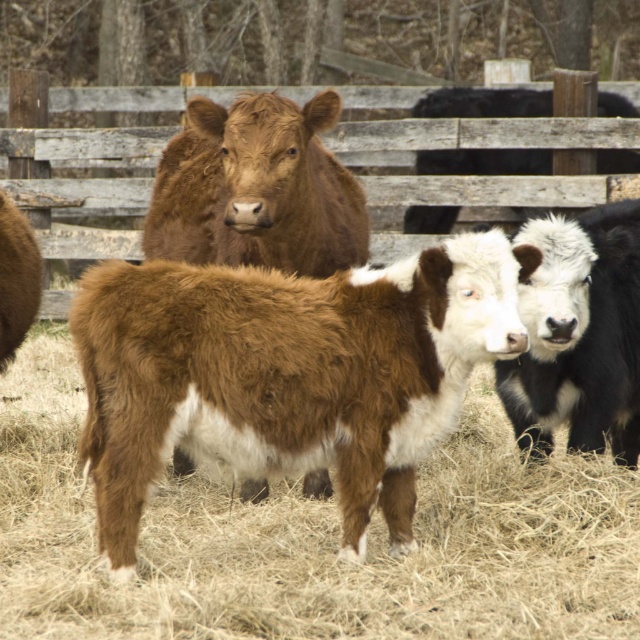
You are a farmer checking the health of your cattle. You observe the black smooth cow at center and the black woolly bull at upper right. Which cow has a thinner body structure?

The black smooth cow at center is thinner than the black woolly bull at upper right.

You are standing in the fenced area looking at the scene. There is a point marked at coordinates (x=579, y=336). Which animal in the scene is located at this point?

The black smooth cow at center is located at the point marked by coordinates (x=579, y=336).

In the scene shown: You are a farmer checking the cattle in the fenced area. You see the black smooth cow at center and the black woolly bull at upper right. Which one is located more to the left side?

The black smooth cow at center is more to the left side because it is positioned on the left side of the black woolly bull at upper right.